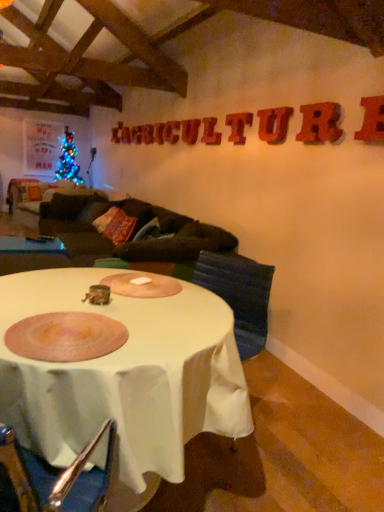
The image size is (384, 512). In order to click on free location above white glossy table at lower left, the first table positioned from the top (from a real-world perspective) in this screenshot , I will do `click(33, 240)`.